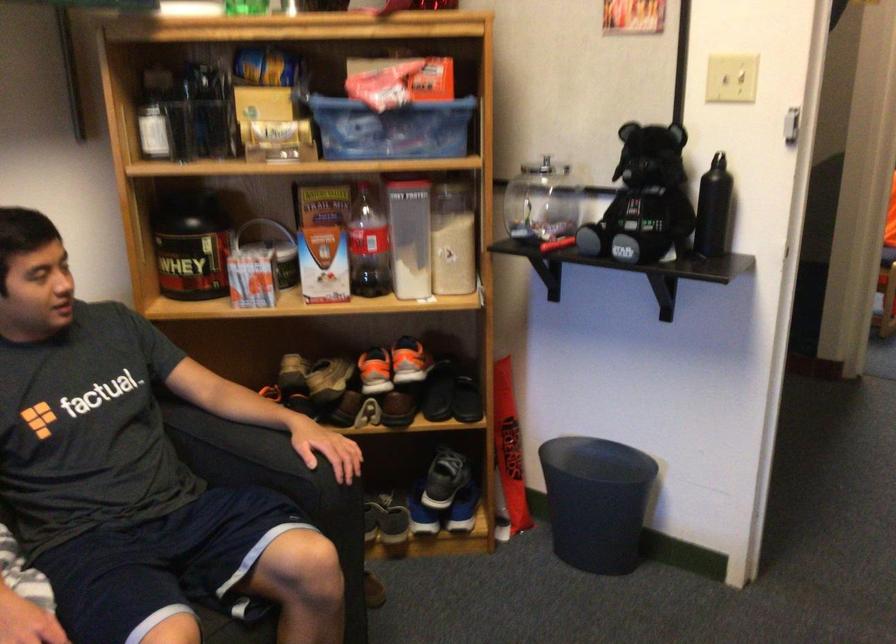
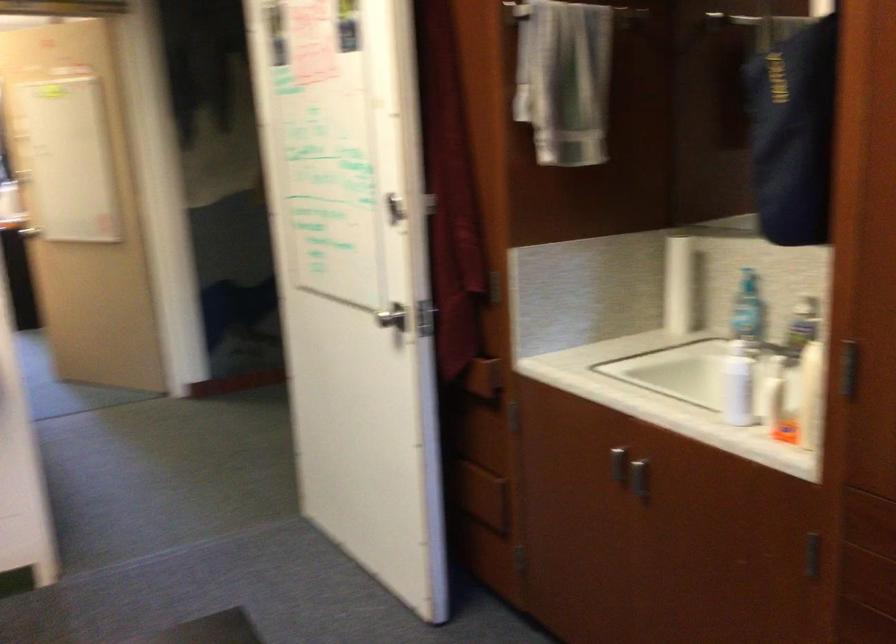
Question: The camera is either moving clockwise (left) or counter-clockwise (right) around the object. The first image is from the beginning of the video and the second image is from the end. Is the camera moving left or right when shooting the video?

Choices:
 (A) Left
 (B) Right

Answer: (A)